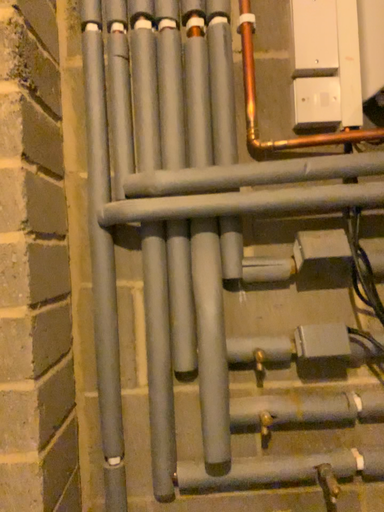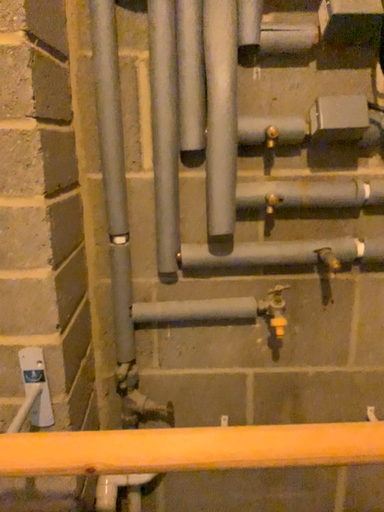
Question: How did the camera likely rotate when shooting the video?

Choices:
 (A) rotated upward
 (B) rotated downward

Answer: (B)